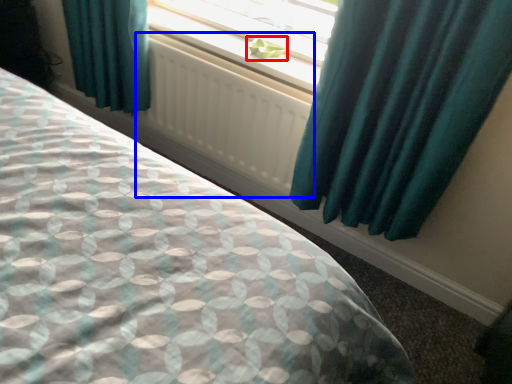
Question: Which object is closer to the camera taking this photo, plant (highlighted by a red box) or radiator (highlighted by a blue box)?

Choices:
 (A) plant
 (B) radiator

Answer: (B)